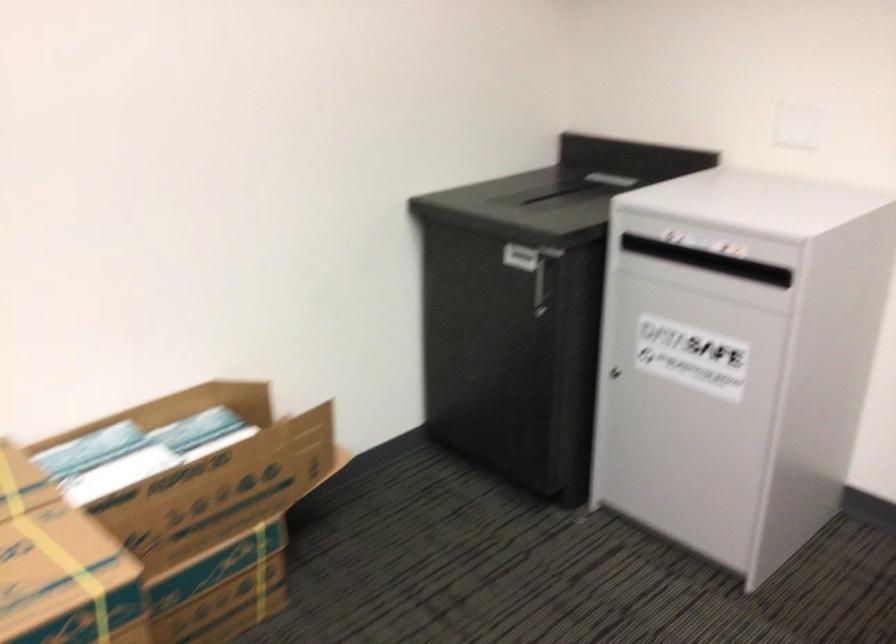
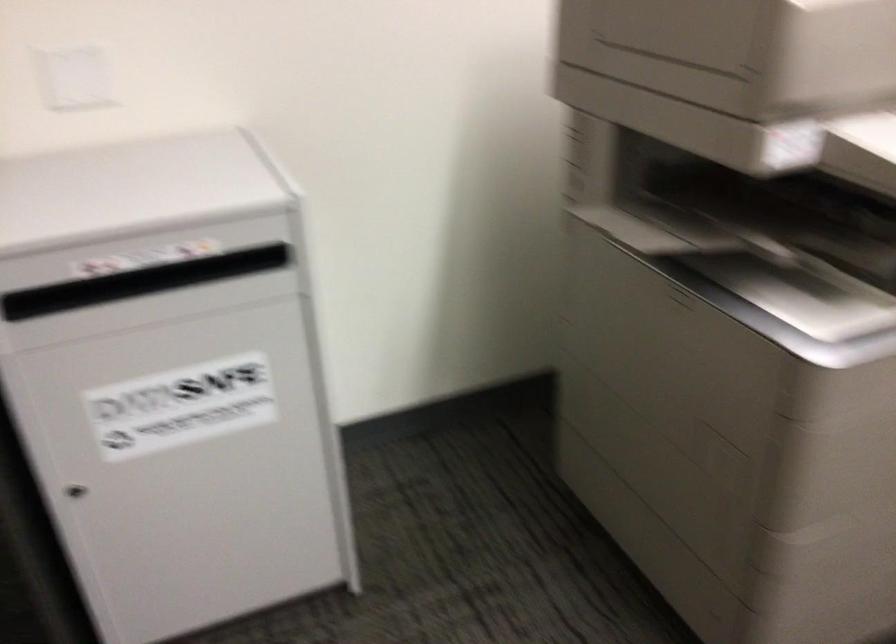
The images are taken continuously from a first-person perspective. In which direction is your viewpoint rotating?

The camera's rotation is toward right-down.